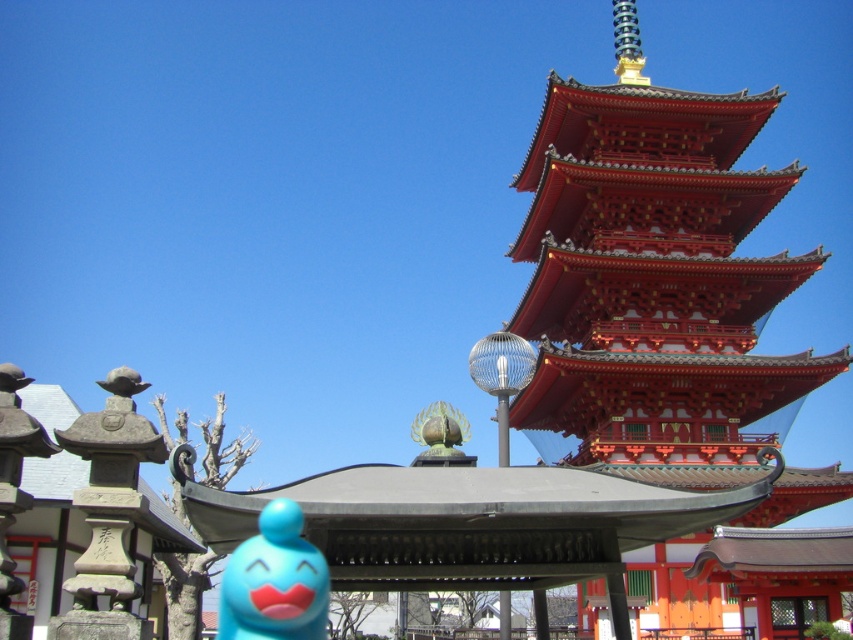
Question: Which point is closer to the camera?

Choices:
 (A) shiny lacquered pagoda at upper right
 (B) matte blue toy at lower left

Answer: (B)

Question: Which point is farther to the camera?

Choices:
 (A) shiny lacquered pagoda at upper right
 (B) matte blue toy at lower left

Answer: (A)

Question: Is shiny lacquered pagoda at upper right below matte blue toy at lower left?

Choices:
 (A) no
 (B) yes

Answer: (A)

Question: Is the position of shiny lacquered pagoda at upper right less distant than that of green matte statue at center?

Choices:
 (A) no
 (B) yes

Answer: (B)

Question: Among these objects, which one is nearest to the camera?

Choices:
 (A) matte blue toy at lower left
 (B) shiny lacquered pagoda at upper right
 (C) green matte statue at center

Answer: (A)

Question: Considering the relative positions of shiny lacquered pagoda at upper right and green matte statue at center in the image provided, where is shiny lacquered pagoda at upper right located with respect to green matte statue at center?

Choices:
 (A) right
 (B) left

Answer: (A)